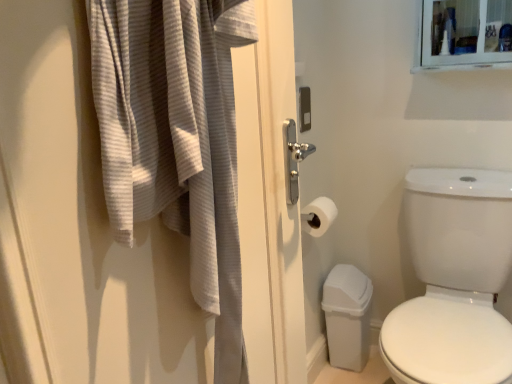
Question: Based on their sizes in the image, would you say white glossy toilet at right is bigger or smaller than white matte toilet paper at center?

Choices:
 (A) big
 (B) small

Answer: (A)

Question: Would you say white glossy toilet at right is to the left or to the right of white matte toilet paper at center in the picture?

Choices:
 (A) left
 (B) right

Answer: (B)

Question: Which object is the farthest from the white matte toilet paper at center?

Choices:
 (A) gray textured bath towel at left
 (B) white glossy toilet at right

Answer: (A)

Question: Which object is positioned farthest from the white glossy toilet at right?

Choices:
 (A) gray textured bath towel at left
 (B) white matte toilet paper at center

Answer: (A)